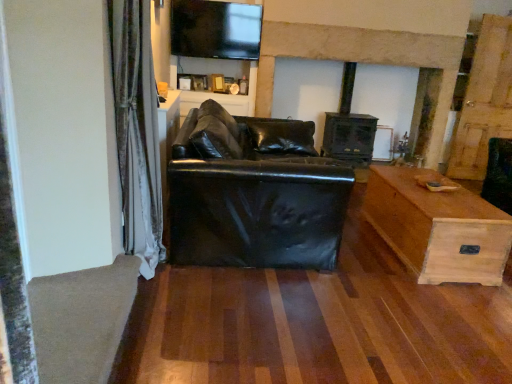
Identify the location of free space in front of velvet curtain at left. (157, 321).